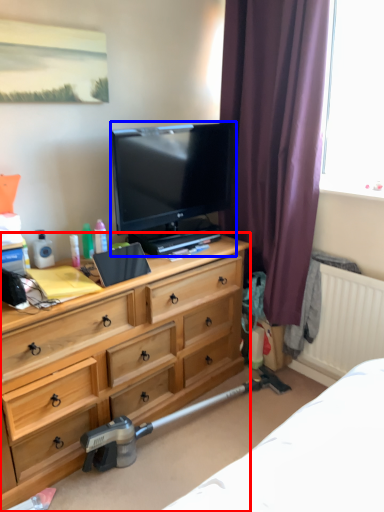
Question: Which of the following is the farthest to the observer, chest of drawers (highlighted by a red box) or television (highlighted by a blue box)?

Choices:
 (A) chest of drawers
 (B) television

Answer: (B)